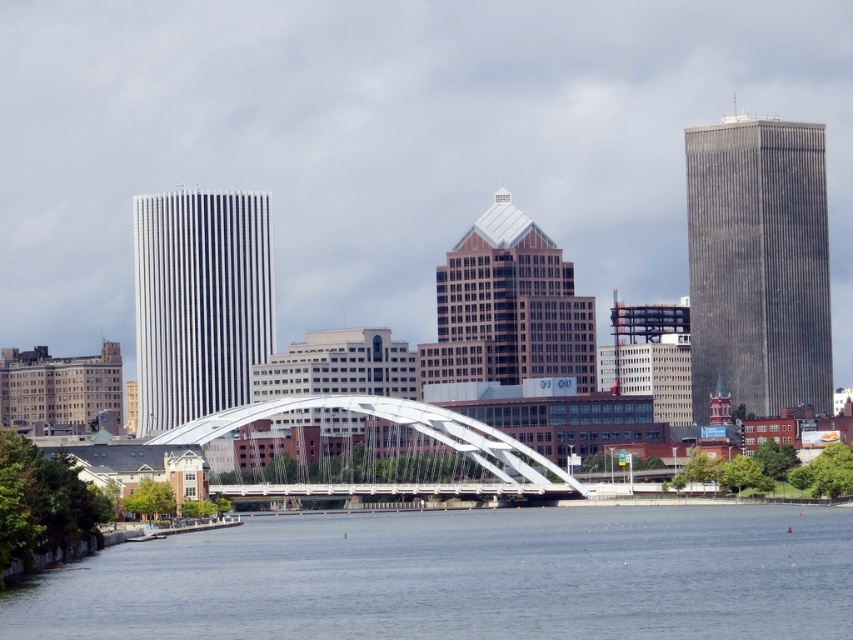
Question: Is white glass skyscraper at center-left thinner than brown glass skyscraper at center?

Choices:
 (A) no
 (B) yes

Answer: (B)

Question: Among these points, which one is farthest from the camera?

Choices:
 (A) (773, 116)
 (B) (296, 397)
 (C) (448, 368)
 (D) (189, 221)

Answer: (A)

Question: Considering the relative positions of blue water at lower center and gray concrete skyscraper at right in the image provided, where is blue water at lower center located with respect to gray concrete skyscraper at right?

Choices:
 (A) left
 (B) right

Answer: (A)

Question: Considering the relative positions of blue water at lower center and white metallic bridge at center in the image provided, where is blue water at lower center located with respect to white metallic bridge at center?

Choices:
 (A) above
 (B) below

Answer: (B)

Question: Among these points, which one is farthest from the camera?

Choices:
 (A) (155, 321)
 (B) (700, 236)
 (C) (289, 401)

Answer: (A)

Question: Which point appears closest to the camera in this image?

Choices:
 (A) (454, 342)
 (B) (318, 406)
 (C) (798, 566)
 (D) (161, 218)

Answer: (A)